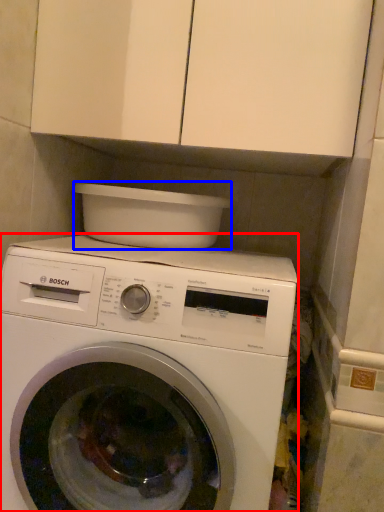
Question: Among these objects, which one is farthest to the camera, washing machine (highlighted by a red box) or appliance (highlighted by a blue box)?

Choices:
 (A) washing machine
 (B) appliance

Answer: (B)